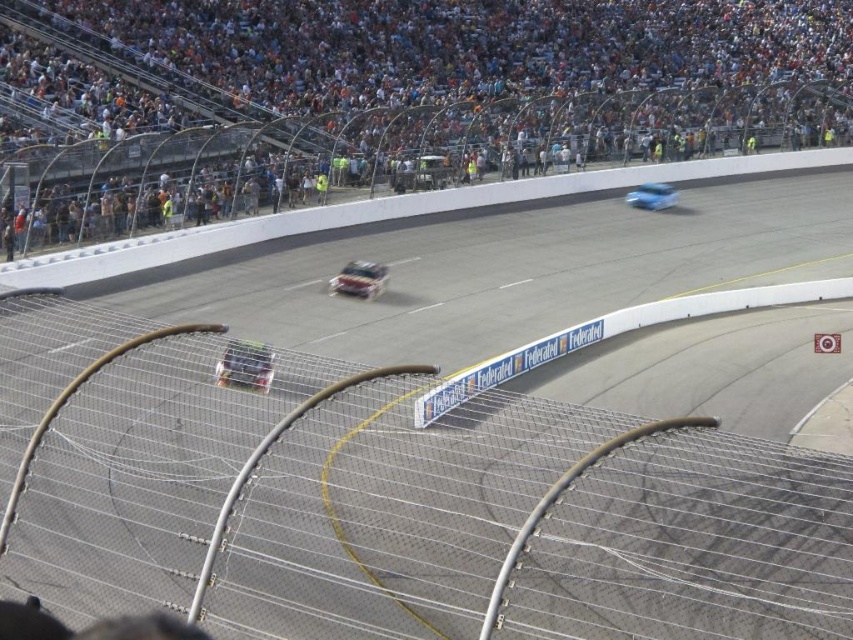
Question: Which of these objects is positioned farthest from the shiny silver race car at center?

Choices:
 (A) white plastic crowd at upper left
 (B) shiny blue car at center
 (C) shiny metallic car at center

Answer: (A)

Question: Which of the following is the closest to the observer?

Choices:
 (A) (643, 182)
 (B) (268, 349)
 (C) (393, 124)

Answer: (B)

Question: Is shiny metallic car at center above shiny blue car at center?

Choices:
 (A) yes
 (B) no

Answer: (B)

Question: Does white plastic crowd at upper left have a larger size compared to shiny silver race car at center?

Choices:
 (A) yes
 (B) no

Answer: (A)

Question: Observing the image, what is the correct spatial positioning of shiny silver race car at center in reference to shiny blue car at center?

Choices:
 (A) right
 (B) left

Answer: (B)

Question: Considering the real-world distances, which object is closest to the shiny metallic car at center?

Choices:
 (A) shiny blue car at center
 (B) white plastic crowd at upper left

Answer: (A)